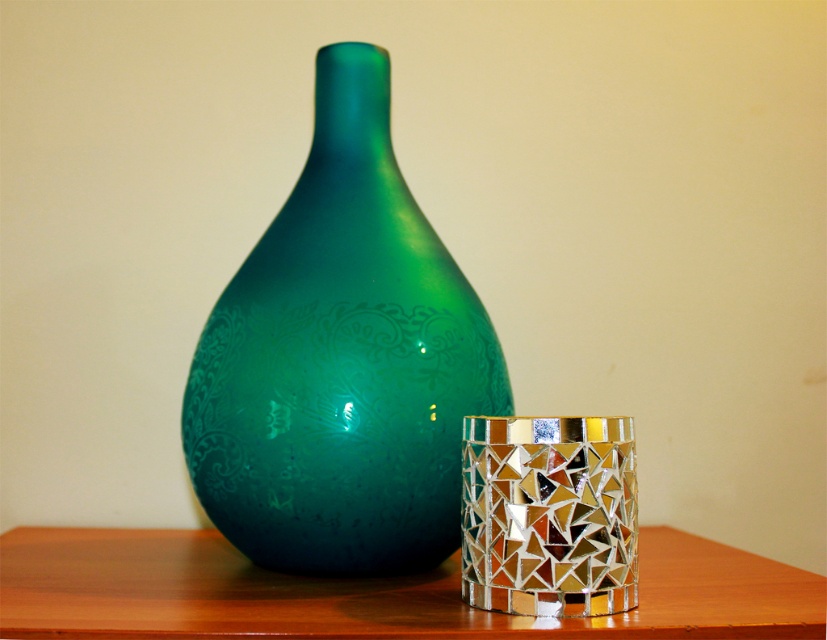
Question: Which of the following is the closest to the observer?

Choices:
 (A) (504, 388)
 (B) (772, 611)
 (C) (541, 481)

Answer: (C)

Question: Does green glossy vase at center appear over mirrored mosaic candle holder at right?

Choices:
 (A) yes
 (B) no

Answer: (A)

Question: Does wooden table at center have a larger size compared to mirrored mosaic candle holder at right?

Choices:
 (A) no
 (B) yes

Answer: (B)

Question: Which is farther from the mirrored mosaic candle holder at right?

Choices:
 (A) green glossy vase at center
 (B) wooden table at center

Answer: (B)

Question: Does wooden table at center have a greater width compared to mirrored mosaic candle holder at right?

Choices:
 (A) yes
 (B) no

Answer: (A)

Question: Which point appears closest to the camera in this image?

Choices:
 (A) (469, 422)
 (B) (815, 611)
 (C) (367, 250)

Answer: (B)